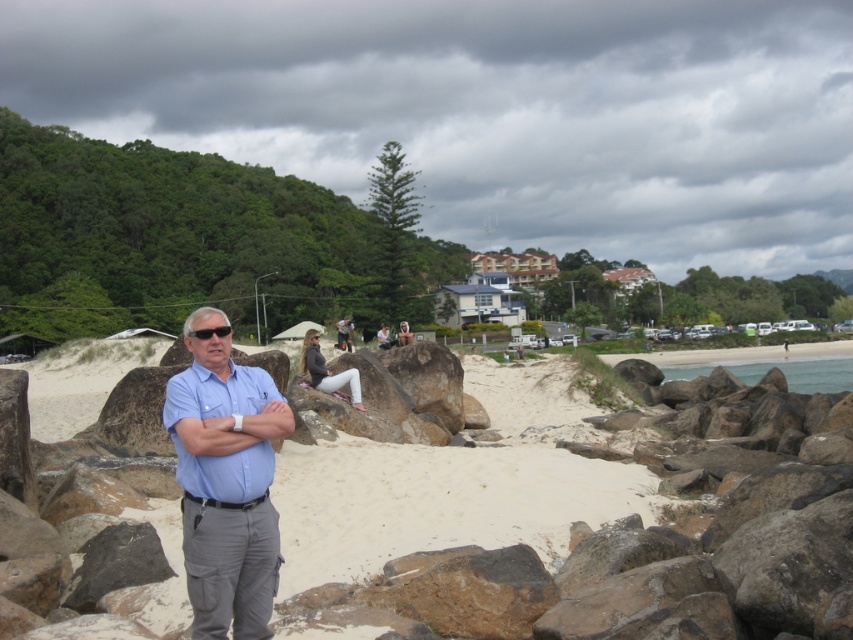
Consider the image. You are a photographer trying to capture a photo of the smooth sand beach at center and the black plastic sunglasses at center. Based on their positions, which object is closer to the camera?

The black plastic sunglasses at center are closer to the camera since they are positioned above the smooth sand beach at center.

You are standing at the beach and want to take a photo of both the point at coordinates point (209, 390) and point (386, 326). Which point should you focus on first to ensure both are in sharp focus?

You should focus on point (209, 390) first because it is closer to the camera than point (386, 326). This ensures that both points will be within the depth of field and in sharp focus.